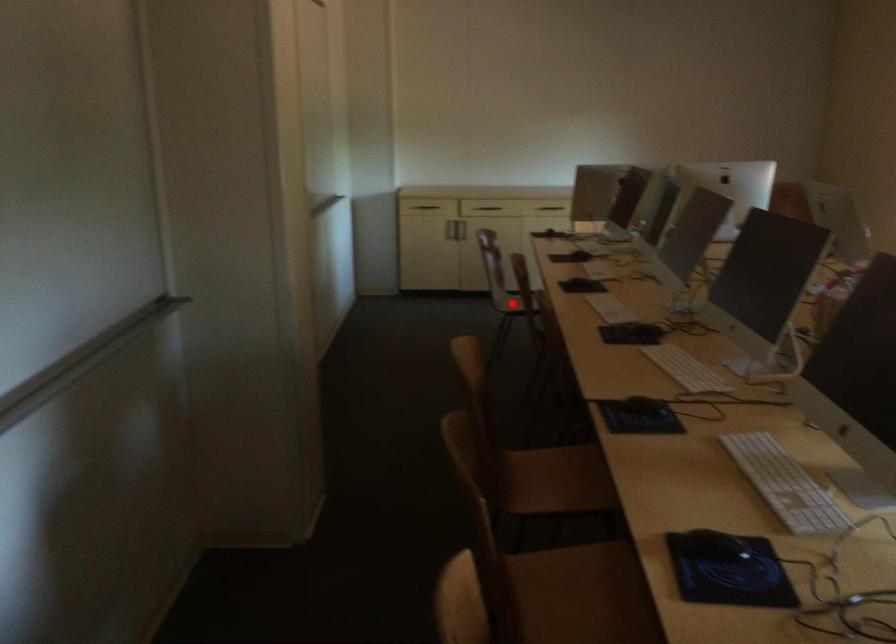
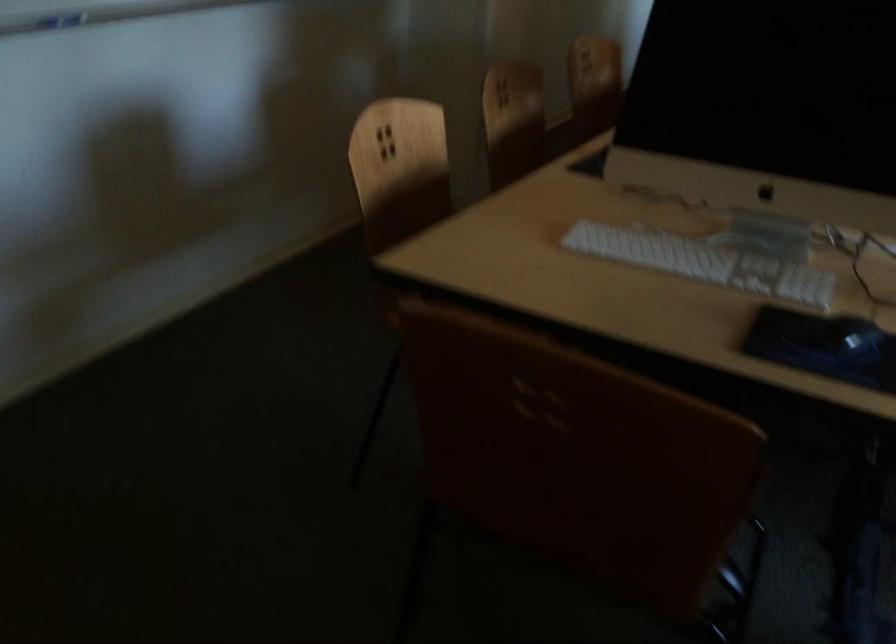
Question: I am providing you with two images of the same scene from different viewpoints. A red point is marked on the first image. At the location where the point appears in image 1, is it still visible in image 2?

Choices:
 (A) Yes
 (B) No

Answer: (B)